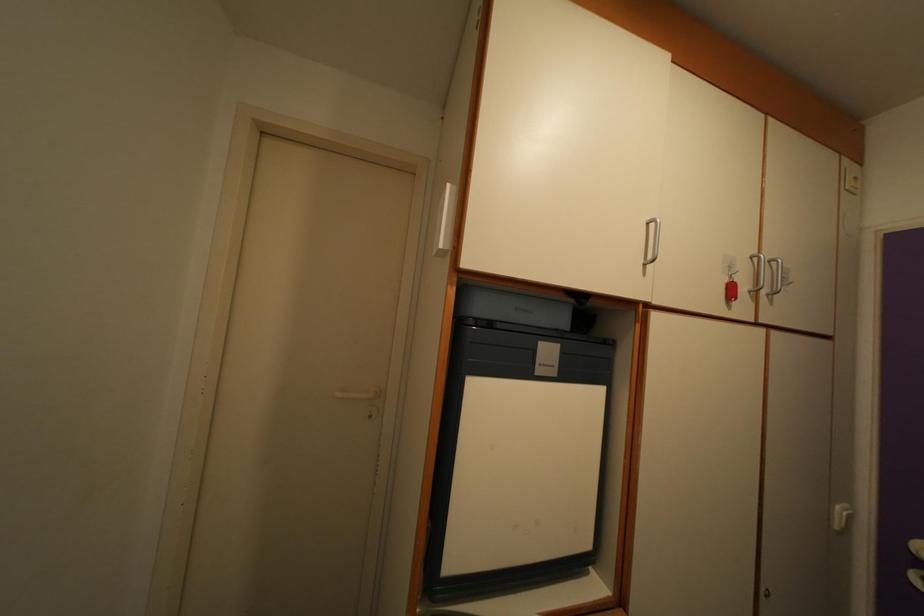
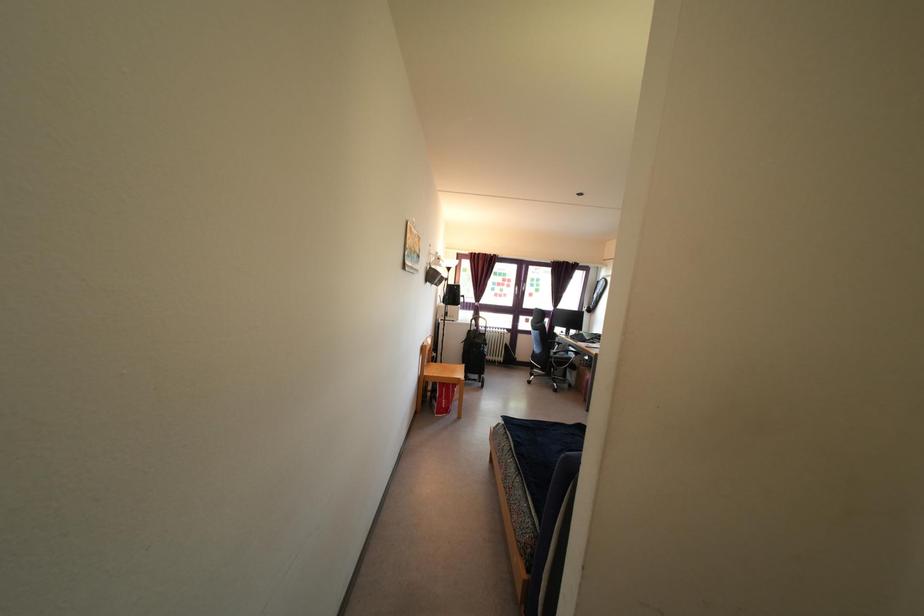
Question: The camera is either moving clockwise (left) or counter-clockwise (right) around the object. The first image is from the beginning of the video and the second image is from the end. Is the camera moving left or right when shooting the video?

Choices:
 (A) Left
 (B) Right

Answer: (B)